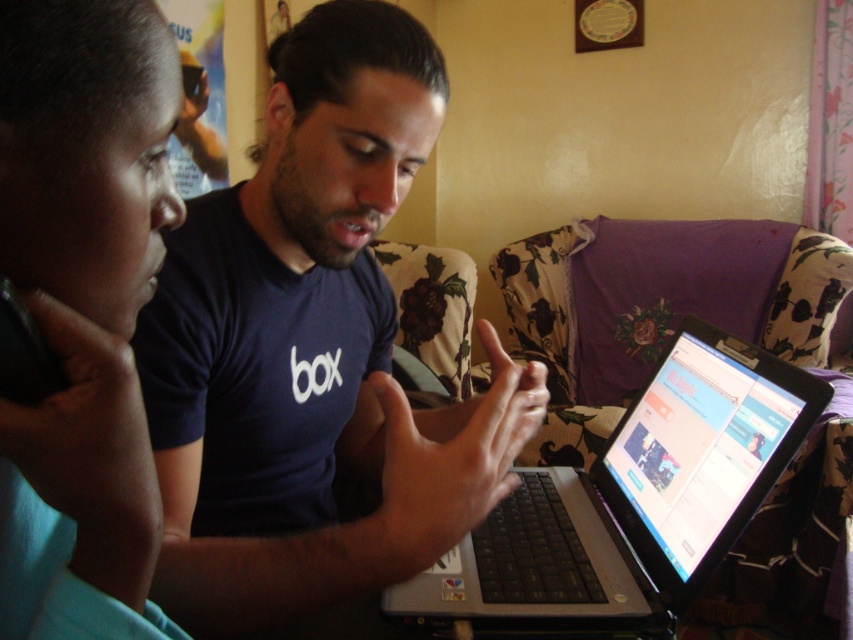
The width and height of the screenshot is (853, 640). I want to click on matte blue shirt at center, so click(x=311, y=349).

The image size is (853, 640). What do you see at coordinates (311, 349) in the screenshot?
I see `matte blue shirt at center` at bounding box center [311, 349].

You are a GUI agent. You are given a task and a screenshot of the screen. Output one action in this format:
    pyautogui.click(x=<x>, y=<y>)
    Task: Click on the matte blue shirt at center
    The image size is (853, 640).
    Given the screenshot: What is the action you would take?
    pyautogui.click(x=311, y=349)

Is matte blue shirt at center thinner than blue fabric at left?

No.

From the picture: Does matte blue shirt at center appear on the right side of blue fabric at left?

Yes, matte blue shirt at center is to the right of blue fabric at left.

Is point (289, 260) farther from camera compared to point (4, 492)?

Yes, point (289, 260) is farther from viewer.

At what (x,y) coordinates should I click in order to perform the action: click on matte blue shirt at center. Please return your answer as a coordinate pair (x, y). Image resolution: width=853 pixels, height=640 pixels. Looking at the image, I should click on (311, 349).

Which is more to the right, blue fabric at left or silver/black plastic laptop at center?

Positioned to the right is silver/black plastic laptop at center.

How much distance is there between blue fabric at left and silver/black plastic laptop at center?

The distance of blue fabric at left from silver/black plastic laptop at center is 20.83 inches.

What do you see at coordinates (83, 308) in the screenshot?
I see `blue fabric at left` at bounding box center [83, 308].

Where is `blue fabric at left`? The width and height of the screenshot is (853, 640). blue fabric at left is located at coordinates (83, 308).